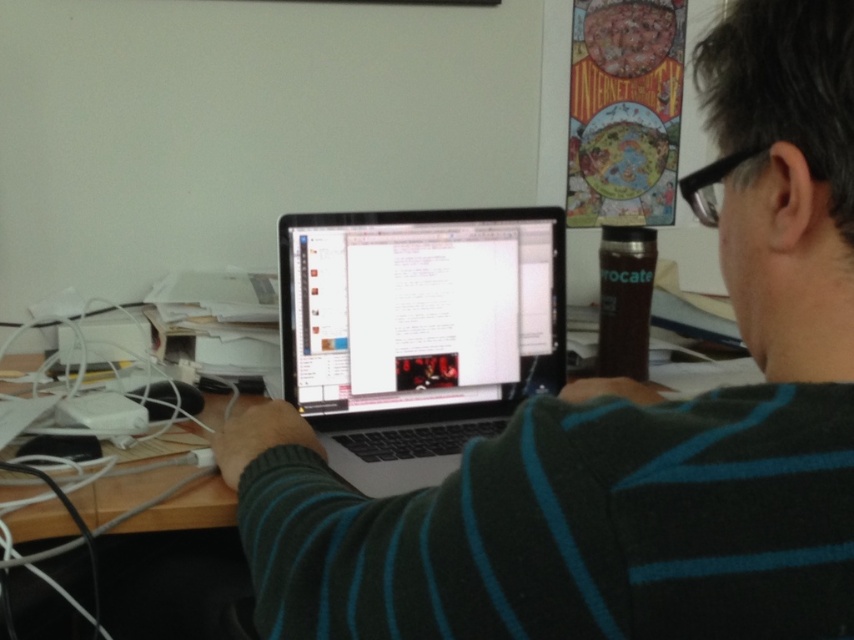
You are a delivery robot with a package that needs to be placed on the desk without touching the black matte laptop at center. The package is 12 inches wide. Is there enough space on the desk to place the package next to the laptop?

The black matte laptop at center and viewer are 13.53 inches apart. Since the package is 12 inches wide, there is enough space to place it next to the laptop without touching it.

In the scene shown: You are organizing your desk and want to place the black matte laptop at center and the sleek silver laptop at center in a straight line from left to right. According to the current arrangement, which laptop should be placed first on the left side?

The black matte laptop at center should be placed first on the left side since it is already positioned on the left side of the sleek silver laptop at center in the current arrangement.

You are organizing the desk and need to place a new item between the black matte laptop at center and the wooden at center. Based on their positions, where should you place the new item?

The black matte laptop at center is to the right of the wooden at center, so you should place the new item between them on the left side of the black matte laptop at center and the right side of the wooden at center.